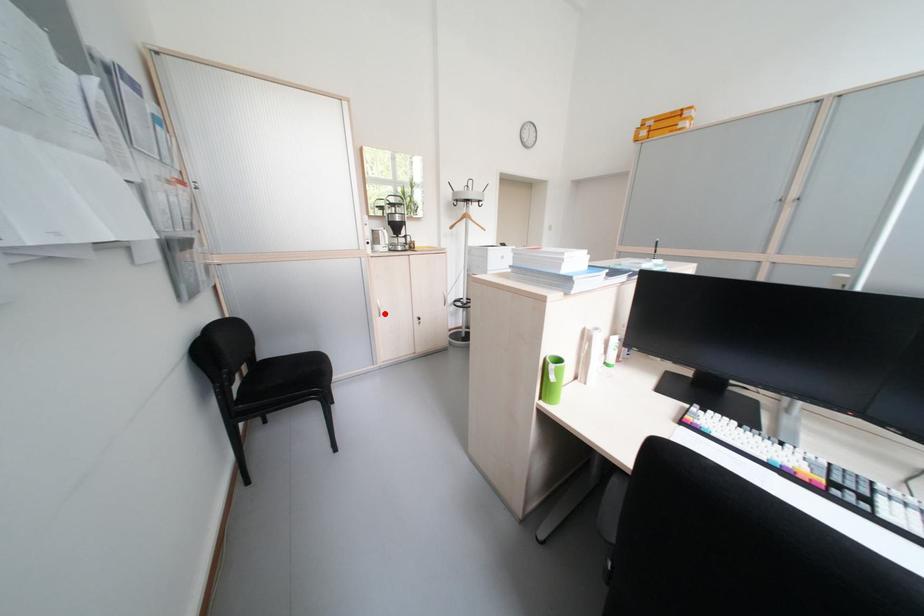
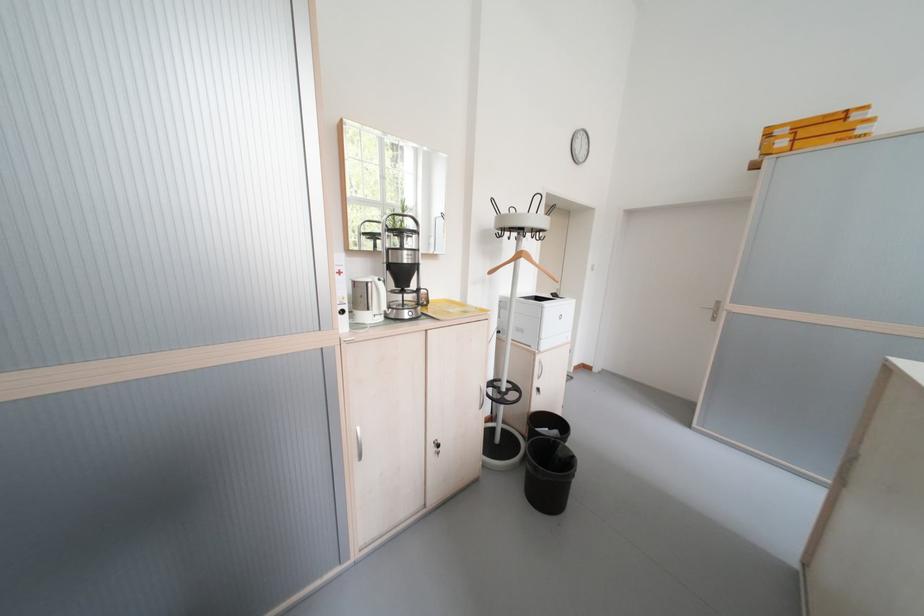
Question: I am providing you with two images of the same scene from different viewpoints. A red point is shown in image1. For the corresponding object point in image2, is it positioned nearer or farther from the camera?

Choices:
 (A) Nearer
 (B) Farther

Answer: (B)